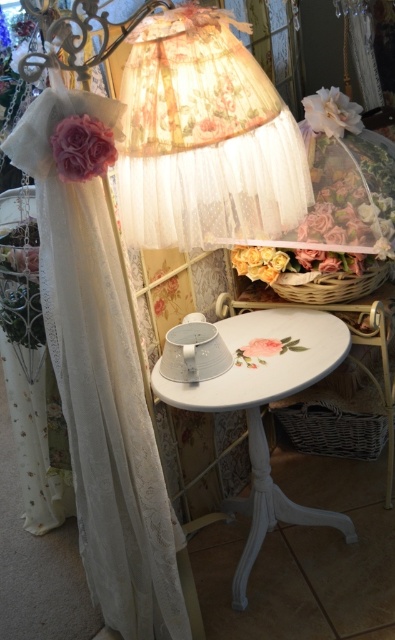
Who is shorter, white painted wood table at center or pink fabric flower at left?

With less height is pink fabric flower at left.

Is white painted wood table at center thinner than pink fabric flower at left?

No, white painted wood table at center is not thinner than pink fabric flower at left.

Does point (287, 499) come farther from viewer compared to point (109, 161)?

That is True.

Identify the location of white painted wood table at center. The width and height of the screenshot is (395, 640). (259, 412).

Is floral lace lampshade at upper center below pink fabric flower at center?

Incorrect, floral lace lampshade at upper center is not positioned below pink fabric flower at center.

Between point (214, 241) and point (253, 339), which one is positioned behind?

The point (253, 339) is more distant.

You are a GUI agent. You are given a task and a screenshot of the screen. Output one action in this format:
    pyautogui.click(x=<x>, y=<y>)
    Task: Click on the floral lace lampshade at upper center
    
    Given the screenshot: What is the action you would take?
    pyautogui.click(x=205, y=138)

Is white lace curtain at left further to camera compared to floral lace lampshade at upper center?

No, white lace curtain at left is closer to the viewer.

Does white lace curtain at left appear on the left side of floral lace lampshade at upper center?

Indeed, white lace curtain at left is positioned on the left side of floral lace lampshade at upper center.

Consider the image. Who is more forward, (165, 520) or (223, 113)?

Point (223, 113)

In order to click on white lace curtain at left in this screenshot , I will do `click(103, 390)`.